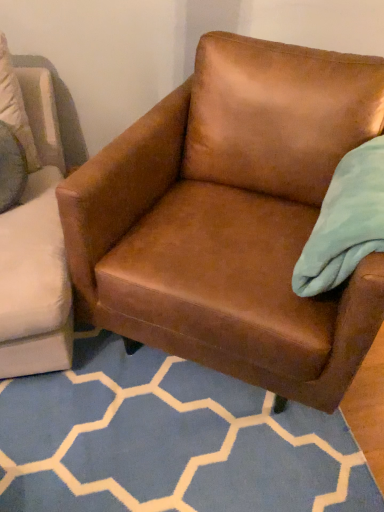
Where is `vacant region under brown leather armchair at center (from a real-world perspective)`? The image size is (384, 512). vacant region under brown leather armchair at center (from a real-world perspective) is located at coordinates (147, 450).